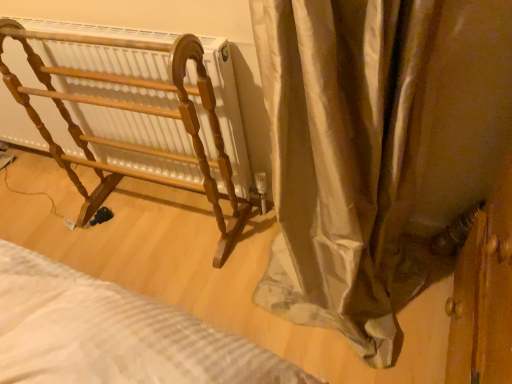
What do you see at coordinates (135, 111) in the screenshot? Image resolution: width=512 pixels, height=384 pixels. I see `wooden rack at left` at bounding box center [135, 111].

Measure the distance between wooden rack at left and camera.

The distance of wooden rack at left from camera is 98.40 centimeters.

Find the location of a particular element. wooden rack at left is located at coordinates point(135,111).

Find the location of a particular element. silky beige curtain at center is located at coordinates (375, 148).

What is the approximate height of silky beige curtain at center?

The height of silky beige curtain at center is 3.32 feet.

What do you see at coordinates (375, 148) in the screenshot?
I see `silky beige curtain at center` at bounding box center [375, 148].

Image resolution: width=512 pixels, height=384 pixels. I want to click on wooden rack at left, so click(135, 111).

Considering the relative positions of wooden rack at left and silky beige curtain at center in the image provided, is wooden rack at left to the left or to the right of silky beige curtain at center?

wooden rack at left is positioned on silky beige curtain at center's left side.

Which is behind, wooden rack at left or silky beige curtain at center?

Positioned behind is wooden rack at left.

Is point (44, 89) closer or farther from the camera than point (343, 204)?

Point (44, 89) is farther from the camera than point (343, 204).

From the picture: From the image's perspective, would you say wooden rack at left is shown under silky beige curtain at center?

Actually, wooden rack at left appears above silky beige curtain at center in the image.

From a real-world perspective, which is physically below, wooden rack at left or silky beige curtain at center?

wooden rack at left.

Is wooden rack at left wider or thinner than silky beige curtain at center?

wooden rack at left is thinner than silky beige curtain at center.

In terms of height, does wooden rack at left look taller or shorter compared to silky beige curtain at center?

In the image, wooden rack at left appears to be shorter than silky beige curtain at center.

Who is bigger, wooden rack at left or silky beige curtain at center?

Bigger between the two is silky beige curtain at center.

Is wooden rack at left located outside silky beige curtain at center?

Yes, wooden rack at left is located beyond the bounds of silky beige curtain at center.

Is wooden rack at left in contact with silky beige curtain at center?

wooden rack at left and silky beige curtain at center are clearly separated.

Is wooden rack at left oriented towards silky beige curtain at center?

No, wooden rack at left is not facing towards silky beige curtain at center.

This screenshot has height=384, width=512. Find the location of `curtain that is below the wooden rack at left (from the image's perspective)`. curtain that is below the wooden rack at left (from the image's perspective) is located at coordinates (375, 148).

Would you say silky beige curtain at center is to the left or to the right of wooden rack at left in the picture?

From the image, it's evident that silky beige curtain at center is to the right of wooden rack at left.

Considering the positions of objects silky beige curtain at center and wooden rack at left in the image provided, who is in front, silky beige curtain at center or wooden rack at left?

silky beige curtain at center.

Is point (340, 124) closer or farther from the camera than point (150, 122)?

Point (340, 124) appears to be closer to the viewer than point (150, 122).

From the image's perspective, is silky beige curtain at center located beneath wooden rack at left?

Yes, from the image's perspective, silky beige curtain at center is beneath wooden rack at left.

From a real-world perspective, is silky beige curtain at center below wooden rack at left?

No, from a real-world perspective, silky beige curtain at center is not beneath wooden rack at left.

Can you confirm if silky beige curtain at center is wider than wooden rack at left?

Yes.

Can you confirm if silky beige curtain at center is shorter than wooden rack at left?

No.

Is silky beige curtain at center bigger or smaller than wooden rack at left?

Considering their sizes, silky beige curtain at center takes up more space than wooden rack at left.

Is silky beige curtain at center not within wooden rack at left?

silky beige curtain at center lies outside wooden rack at left's area.

Are silky beige curtain at center and wooden rack at left far apart?

silky beige curtain at center is actually quite close to wooden rack at left.

Is silky beige curtain at center facing towards wooden rack at left?

No.

The width and height of the screenshot is (512, 384). In the image, there is a silky beige curtain at center. Identify the location of furniture below it (from a real-world perspective). (135, 111).

Image resolution: width=512 pixels, height=384 pixels. Find the location of `furniture on the left of silky beige curtain at center`. furniture on the left of silky beige curtain at center is located at coordinates (135, 111).

Where is `curtain in front of the wooden rack at left`? This screenshot has height=384, width=512. curtain in front of the wooden rack at left is located at coordinates (375, 148).